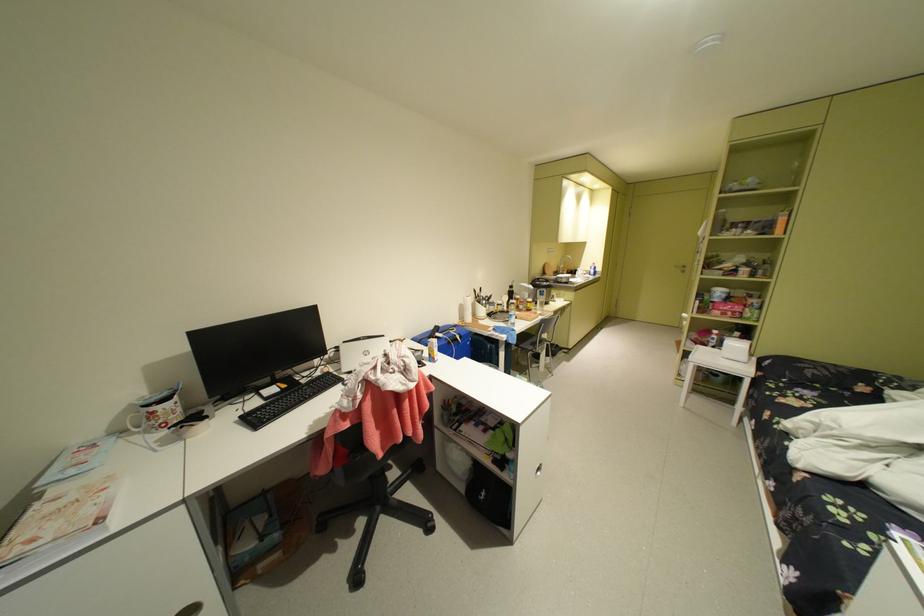
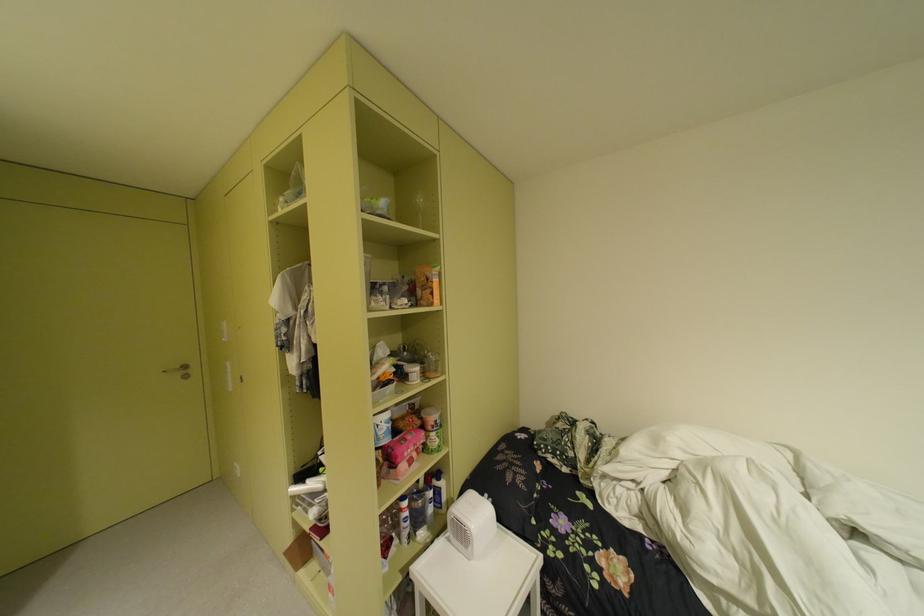
Find the pixel in the second image that matches (760,232) in the first image.

(417, 301)